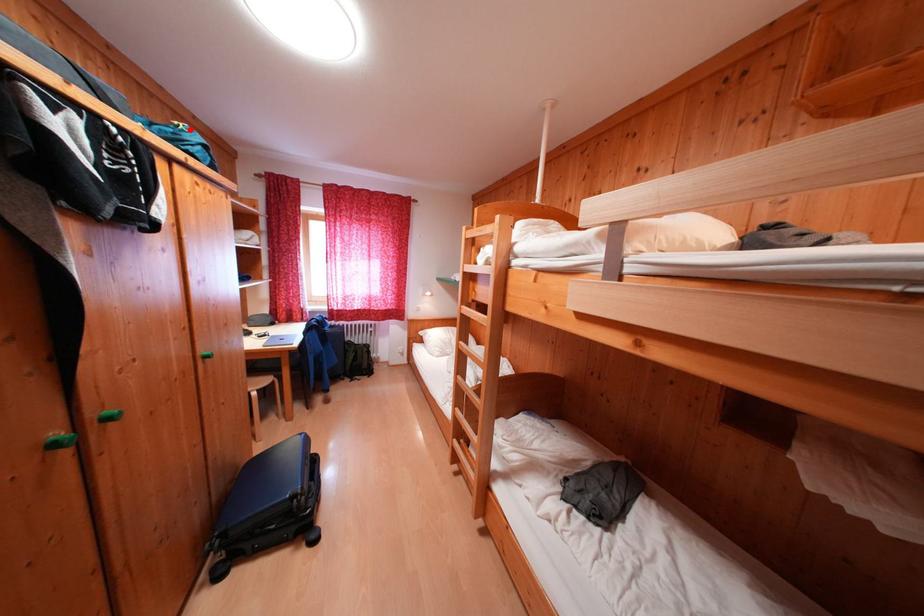
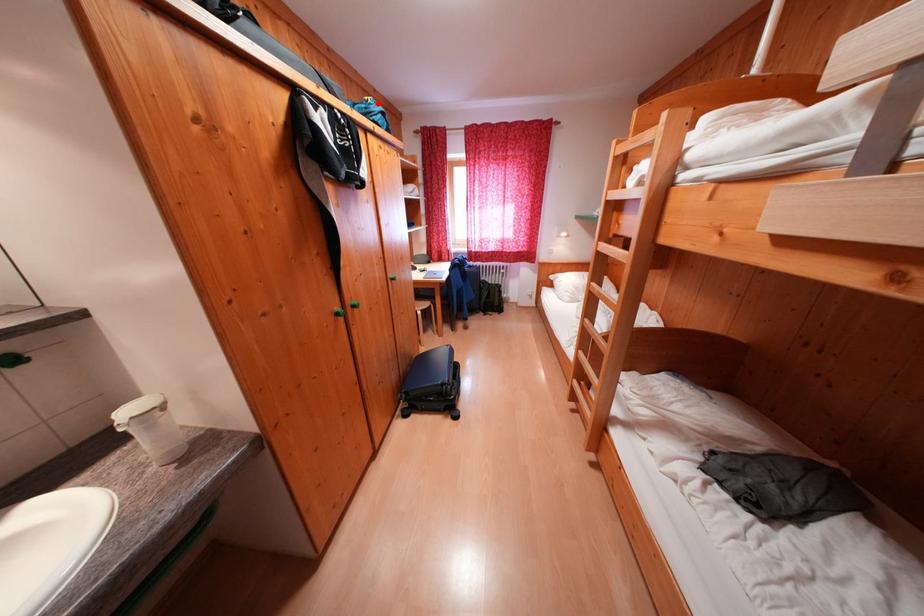
I am providing you with two images of the same scene from different viewpoints. A red point is marked on the first image and another point is marked on the second image. Is the marked point in image1 the same physical position as the marked point in image2?

Yes